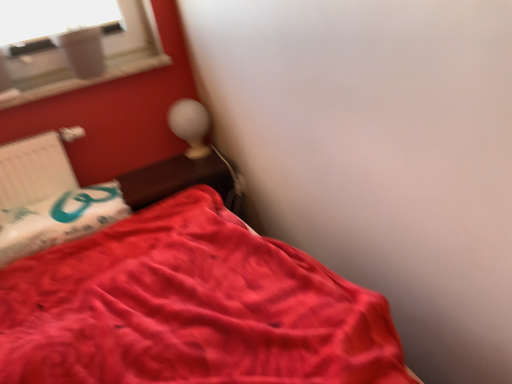
Find the location of a particular element. The image size is (512, 384). free point above wooden table at upper center (from a real-world perspective) is located at coordinates (174, 177).